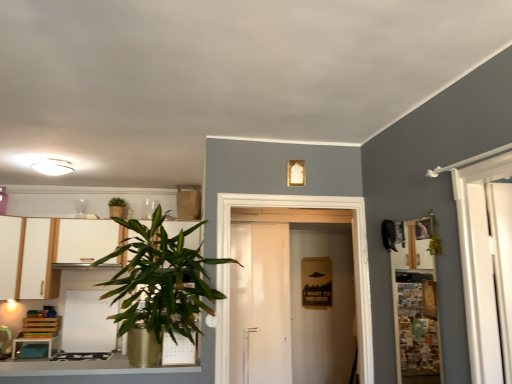
I want to click on vacant area on top of white glossy stove at lower left (from a real-world perspective), so click(82, 289).